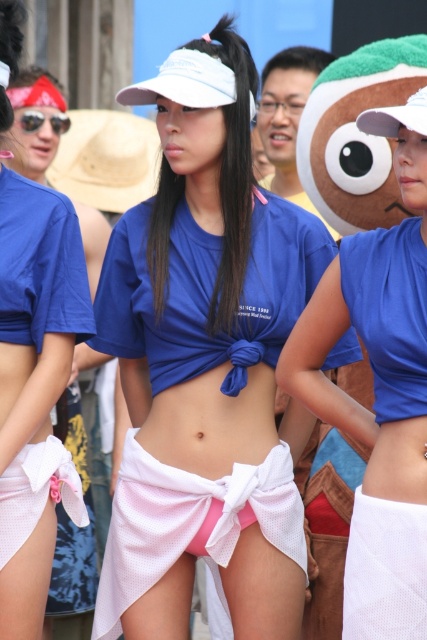
Question: Is matte blue bikini top at center closer to camera compared to white mesh underwear at lower center?

Choices:
 (A) no
 (B) yes

Answer: (A)

Question: Does white mesh skirt at center appear over pink mesh underwear at center?

Choices:
 (A) no
 (B) yes

Answer: (B)

Question: Which of the following is the closest to the observer?

Choices:
 (A) (122, 582)
 (B) (394, 454)
 (C) (421, 540)
 (D) (55, 481)

Answer: (C)

Question: Can you confirm if matte blue shirt at center is positioned below pink mesh underwear at center?

Choices:
 (A) yes
 (B) no

Answer: (B)

Question: Which object appears closest to the camera in this image?

Choices:
 (A) matte blue bikini top at center
 (B) white mesh underwear at lower center
 (C) matte blue t-shirt at center
 (D) pink mesh underwear at center

Answer: (B)

Question: Estimate the real-world distances between objects in this image. Which object is farther from the pink mesh underwear at center?

Choices:
 (A) white mesh underwear at lower center
 (B) matte blue bikini top at center
 (C) pink mesh underwear at lower left

Answer: (B)